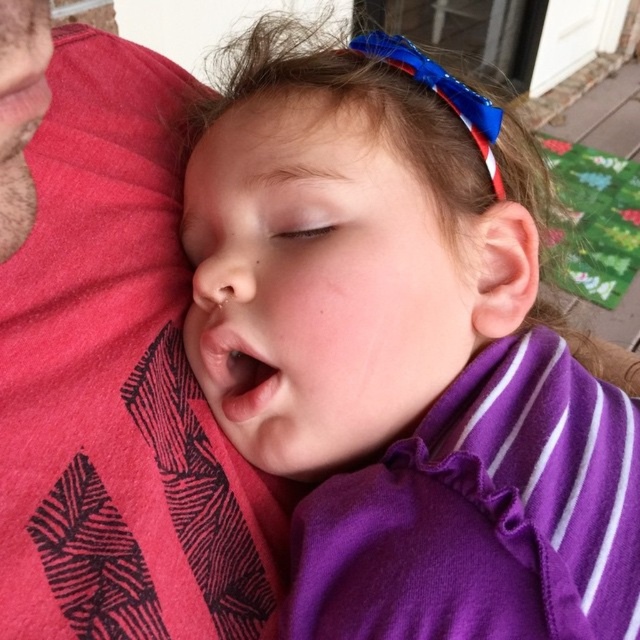
Based on the photo, does smooth skin face at center appear on the left side of smooth skin at upper center?

In fact, smooth skin face at center is to the right of smooth skin at upper center.

Does smooth skin face at center have a greater width compared to smooth skin at upper center?

Yes, smooth skin face at center is wider than smooth skin at upper center.

Which is behind, point (305, 136) or point (362, 109)?

Positioned behind is point (362, 109).

Locate an element on the screen. The height and width of the screenshot is (640, 640). smooth skin face at center is located at coordinates (321, 282).

Is purple fabric at center thinner than smooth skin face at center?

In fact, purple fabric at center might be wider than smooth skin face at center.

Can you confirm if purple fabric at center is positioned to the right of smooth skin face at center?

Yes, purple fabric at center is to the right of smooth skin face at center.

Does point (236, 378) come closer to viewer compared to point (412, 164)?

No, it is not.

The width and height of the screenshot is (640, 640). Find the location of `purple fabric at center`. purple fabric at center is located at coordinates (403, 358).

Which is more to the left, pink fabric at left or smooth skin at upper center?

From the viewer's perspective, pink fabric at left appears more on the left side.

Measure the distance between pink fabric at left and smooth skin at upper center.

A distance of 5.09 inches exists between pink fabric at left and smooth skin at upper center.

Image resolution: width=640 pixels, height=640 pixels. Describe the element at coordinates (115, 380) in the screenshot. I see `pink fabric at left` at that location.

I want to click on pink fabric at left, so coord(115,380).